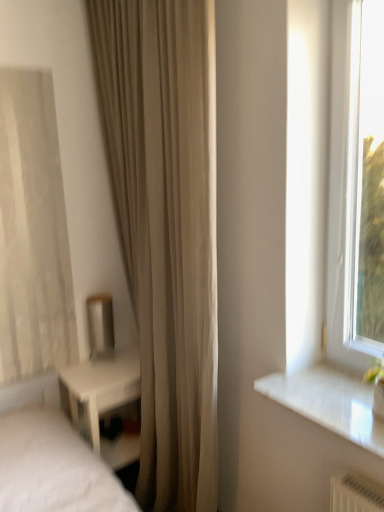
Question: Is white glossy nightstand at lower left wider or thinner than beige fabric curtain at center?

Choices:
 (A) wide
 (B) thin

Answer: (A)

Question: In the image, is white glossy nightstand at lower left positioned in front of or behind beige fabric curtain at center?

Choices:
 (A) behind
 (B) front

Answer: (A)

Question: From a real-world perspective, relative to beige fabric curtain at center, is white glossy nightstand at lower left vertically above or below?

Choices:
 (A) below
 (B) above

Answer: (A)

Question: Looking at their shapes, would you say beige fabric curtain at center is wider or thinner than white glossy nightstand at lower left?

Choices:
 (A) wide
 (B) thin

Answer: (B)

Question: Is beige fabric curtain at center bigger or smaller than white glossy nightstand at lower left?

Choices:
 (A) small
 (B) big

Answer: (B)

Question: From the image's perspective, relative to white glossy nightstand at lower left, is beige fabric curtain at center above or below?

Choices:
 (A) below
 (B) above

Answer: (B)

Question: Considering their positions, is beige fabric curtain at center located in front of or behind white glossy nightstand at lower left?

Choices:
 (A) behind
 (B) front

Answer: (B)